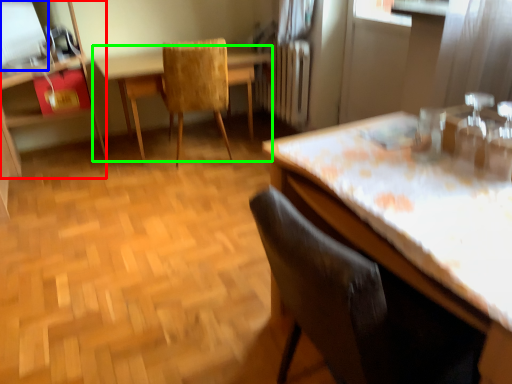
Question: Considering the real-world distances, which object is farthest from dresser (highlighted by a red box)? window screen (highlighted by a blue box) or table (highlighted by a green box)?

Choices:
 (A) window screen
 (B) table

Answer: (B)